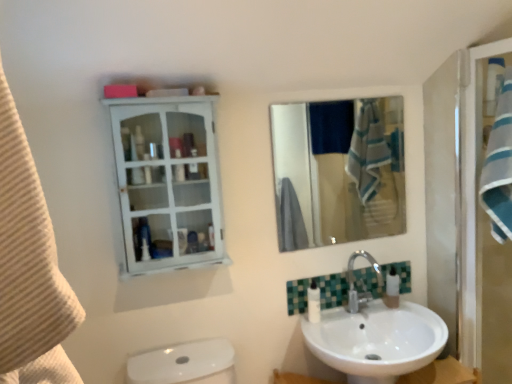
Question: Is white glossy cabinet at upper left to the right of beige textured towel at left from the viewer's perspective?

Choices:
 (A) no
 (B) yes

Answer: (A)

Question: Can you confirm if white glossy cabinet at upper left is taller than beige textured towel at left?

Choices:
 (A) no
 (B) yes

Answer: (B)

Question: Considering the relative sizes of white glossy cabinet at upper left and beige textured towel at left in the image provided, is white glossy cabinet at upper left smaller than beige textured towel at left?

Choices:
 (A) yes
 (B) no

Answer: (B)

Question: Would you say beige textured towel at left is part of white glossy cabinet at upper left's contents?

Choices:
 (A) yes
 (B) no

Answer: (B)

Question: From the image's perspective, does white glossy cabinet at upper left appear higher than beige textured towel at left?

Choices:
 (A) no
 (B) yes

Answer: (B)

Question: Is white glossy sink at lower right taller or shorter than white glossy lotion at lower center?

Choices:
 (A) short
 (B) tall

Answer: (B)

Question: Looking at the image, does white glossy sink at lower right seem bigger or smaller compared to white glossy lotion at lower center?

Choices:
 (A) big
 (B) small

Answer: (A)

Question: From the image's perspective, is white glossy sink at lower right located above or below white glossy lotion at lower center?

Choices:
 (A) above
 (B) below

Answer: (B)

Question: Do you think white glossy sink at lower right is within white glossy lotion at lower center, or outside of it?

Choices:
 (A) inside
 (B) outside

Answer: (B)

Question: From the image's perspective, relative to white glossy cabinet at upper left, is beige textured towel at left above or below?

Choices:
 (A) above
 (B) below

Answer: (B)

Question: Is beige textured towel at left wider or thinner than white glossy cabinet at upper left?

Choices:
 (A) thin
 (B) wide

Answer: (A)

Question: Does point (39, 208) appear closer or farther from the camera than point (156, 147)?

Choices:
 (A) closer
 (B) farther

Answer: (A)

Question: Which is correct: beige textured towel at left is inside white glossy cabinet at upper left, or outside of it?

Choices:
 (A) inside
 (B) outside

Answer: (B)

Question: Considering the positions of polished chrome faucet at lower center and white glossy cabinet at upper left in the image, is polished chrome faucet at lower center taller or shorter than white glossy cabinet at upper left?

Choices:
 (A) short
 (B) tall

Answer: (A)

Question: From the image's perspective, is polished chrome faucet at lower center positioned above or below white glossy cabinet at upper left?

Choices:
 (A) below
 (B) above

Answer: (A)